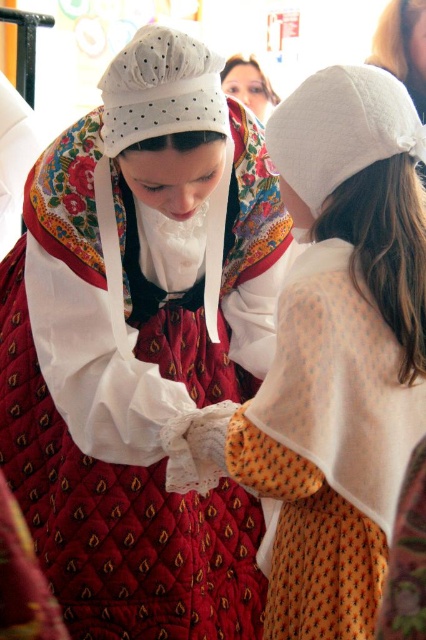
You are an observer standing in front of the scene. You see the quilted red dress at center and the white cotton cap at upper center. Which object is taller?

The quilted red dress at center is much taller than the white cotton cap at upper center.

Based on the scene description, which object is positioned higher up in the image, the quilted red dress at center or the white cotton bonnet at upper center?

The white cotton bonnet at upper center is positioned higher up in the image than the quilted red dress at center.

You are standing in the scene and want to place a small decoration exactly at the point marked by coordinates point (141, 348). Which object from the scene will this decoration land on?

The point (141, 348) is located on the quilted red dress at center, so the decoration will land on the quilted red dress at center.